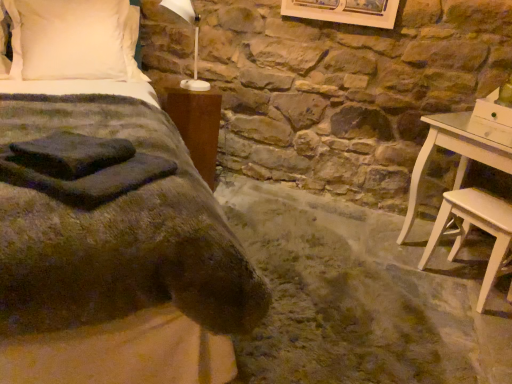
The height and width of the screenshot is (384, 512). I want to click on vacant space situated on the left part of light wood stool at lower right, so click(411, 278).